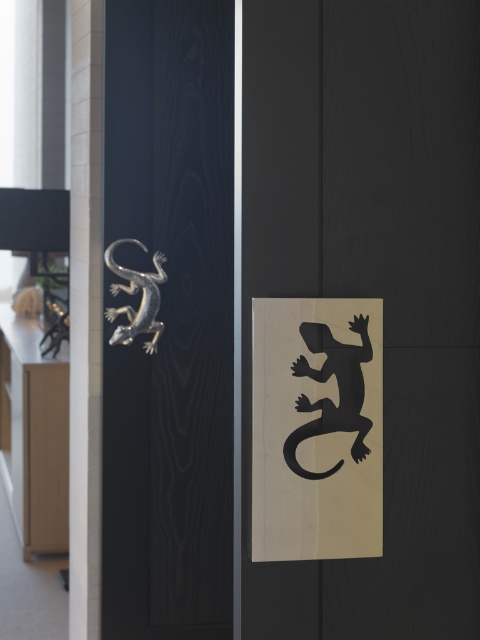
Question: In this image, where is metallic lizard at center located relative to black paper lizard at center?

Choices:
 (A) above
 (B) below

Answer: (A)

Question: Which point is closer to the camera taking this photo?

Choices:
 (A) (154, 344)
 (B) (228, 129)

Answer: (A)

Question: Is metallic lizard at center behind black paper lizard at center?

Choices:
 (A) no
 (B) yes

Answer: (B)

Question: Which point is closer to the camera?

Choices:
 (A) metallic lizard at center
 (B) black paper lizard at center

Answer: (B)

Question: Considering the relative positions of black paper lizard at center and black matte lizard at center in the image provided, where is black paper lizard at center located with respect to black matte lizard at center?

Choices:
 (A) right
 (B) left

Answer: (B)

Question: Estimate the real-world distances between objects in this image. Which object is closer to the black paper lizard at center?

Choices:
 (A) metallic lizard at center
 (B) black matte lizard at center

Answer: (B)